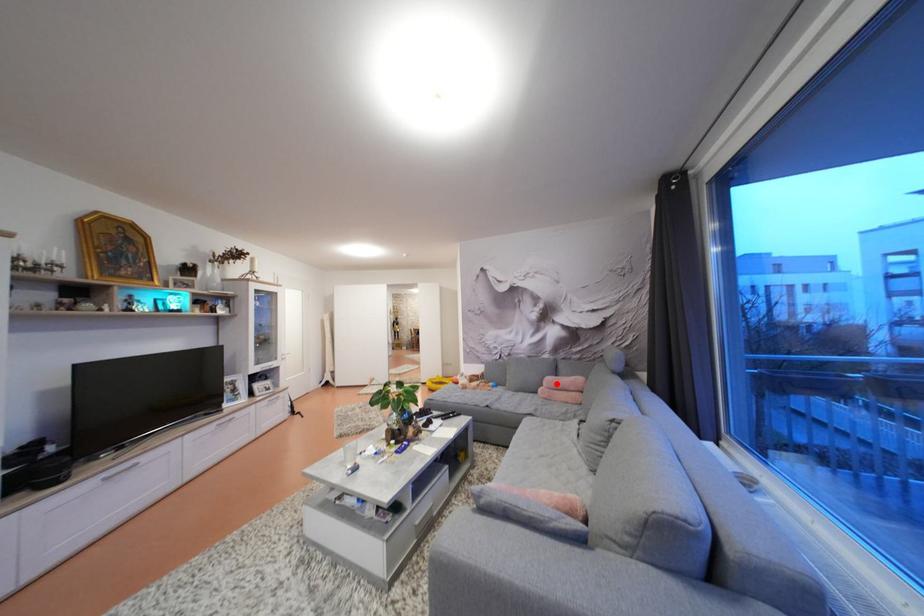
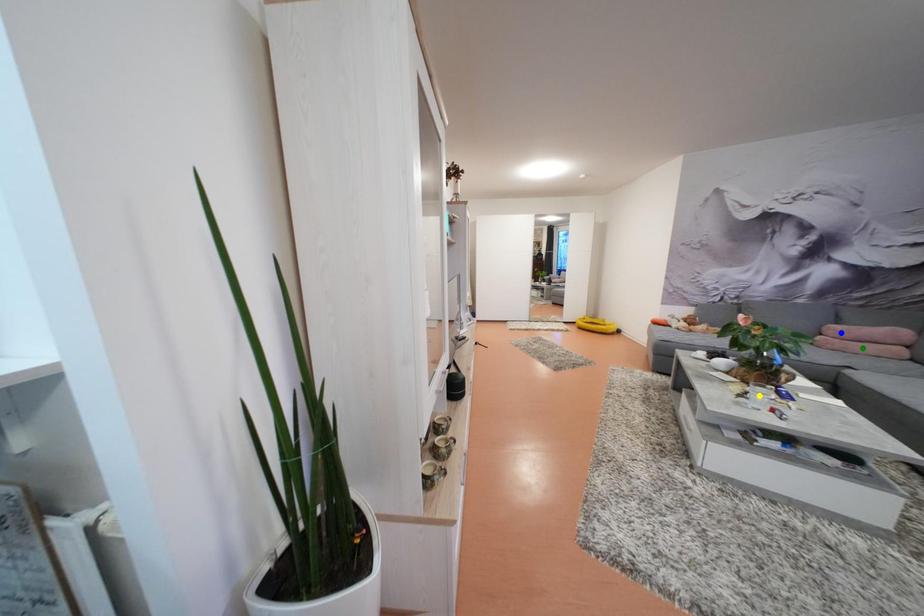
Question: I am providing you with two images of the same scene from different viewpoints. A red point is marked on the first image. You are given multiple points on the second image. In image 2, which mark is for the same physical point as the one in image 1?

Choices:
 (A) green point
 (B) yellow point
 (C) blue point

Answer: (C)